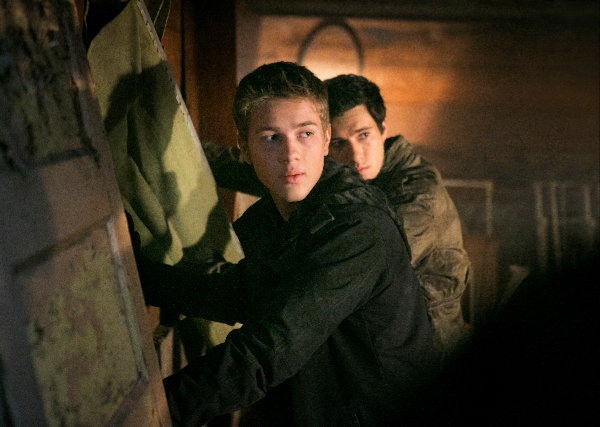
Identify the location of door. (54, 214).